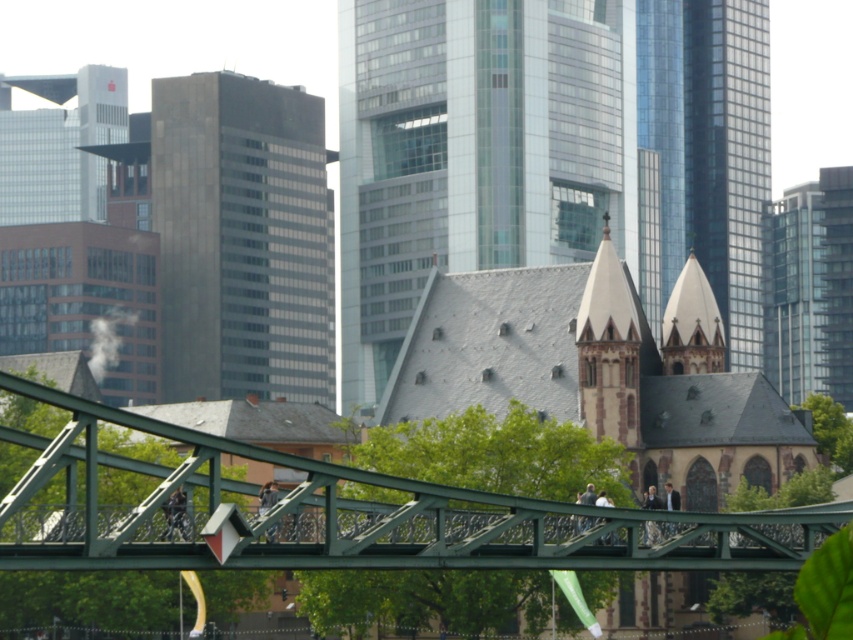
You are an urban planner assessing the visual impact of the gray slate roof at center and the shiny glass tower at upper right. Which structure takes up more visual space in the image?

The shiny glass tower at upper right occupies more visual space than the gray slate roof at center, as it takes up more area in the image.

You are an urban planner assessing the width of architectural features in the scene. Which object has a smaller width between the gray slate roof at center and the green metallic bridge at lower center?

The gray slate roof at center has a smaller width than the green metallic bridge at lower center.

You are a city planner who wants to install a new streetlight between the green pedestrian bridge and the gray slate roof at center. The streetlight requires a minimum of 150 meters of space between the two structures to be installed safely. Based on the provided information, can the streetlight be placed there?

The distance between the green pedestrian bridge and the gray slate roof at center is 141.63 meters, which is less than the required 150 meters. Therefore, the streetlight cannot be safely installed there.